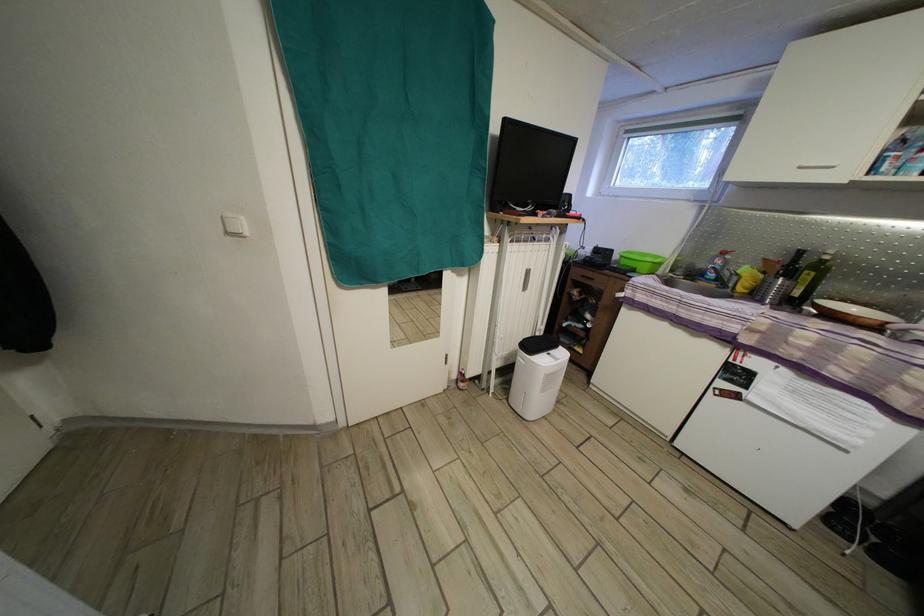
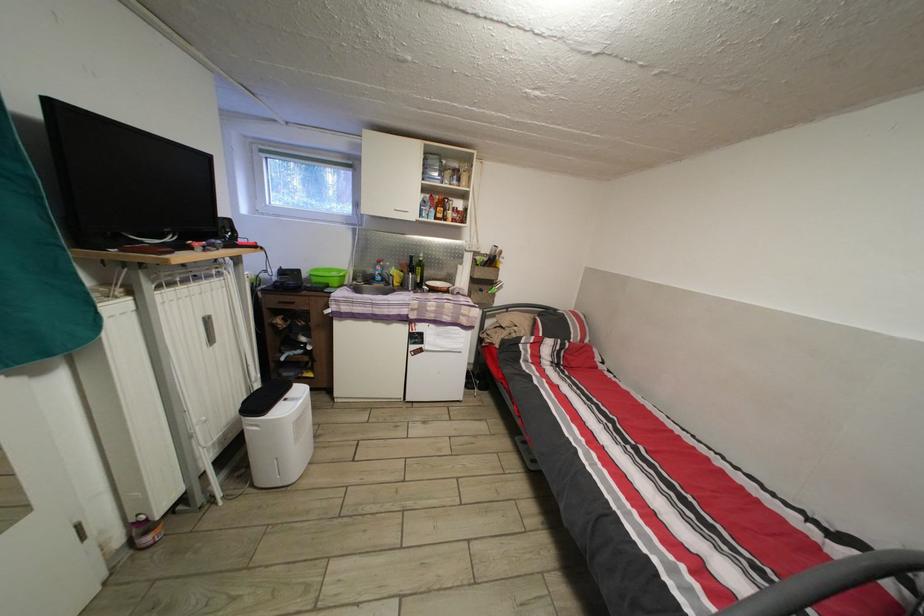
In the second image, find the point that corresponds to the point at 634,138 in the first image.

(269, 156)